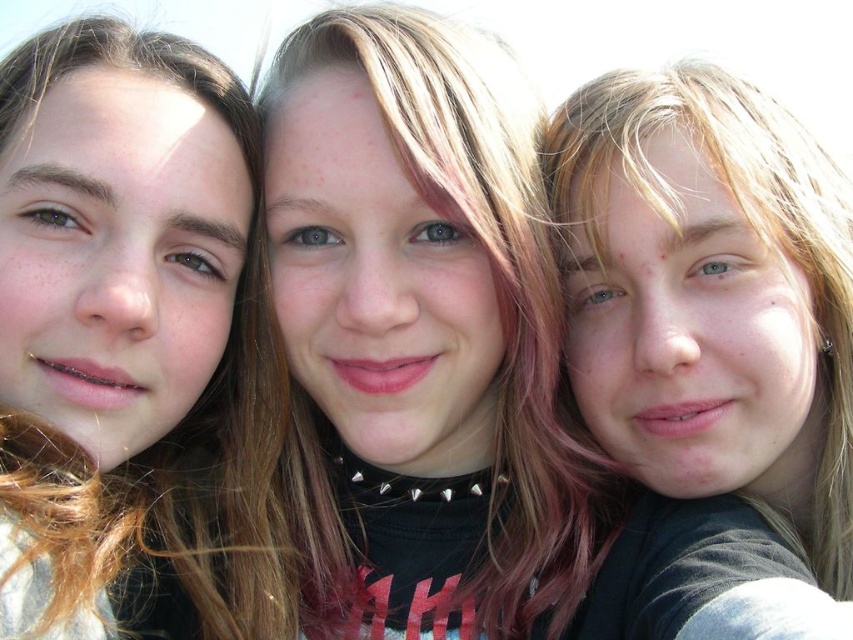
Question: Which of the following is the farthest from the observer?

Choices:
 (A) (166, 173)
 (B) (741, 292)
 (C) (335, 374)

Answer: (C)

Question: Where is matte black shirt at center located in relation to brown hair at left in the image?

Choices:
 (A) left
 (B) right

Answer: (B)

Question: Can you confirm if matte black shirt at center is positioned below matte black hair at center?

Choices:
 (A) yes
 (B) no

Answer: (A)

Question: Is brown hair at left above matte black hair at center?

Choices:
 (A) no
 (B) yes

Answer: (A)

Question: Which is nearer to the matte black shirt at center?

Choices:
 (A) brown hair at left
 (B) matte black hair at center

Answer: (A)

Question: Which point is closer to the camera?

Choices:
 (A) matte black shirt at center
 (B) matte black hair at center

Answer: (A)